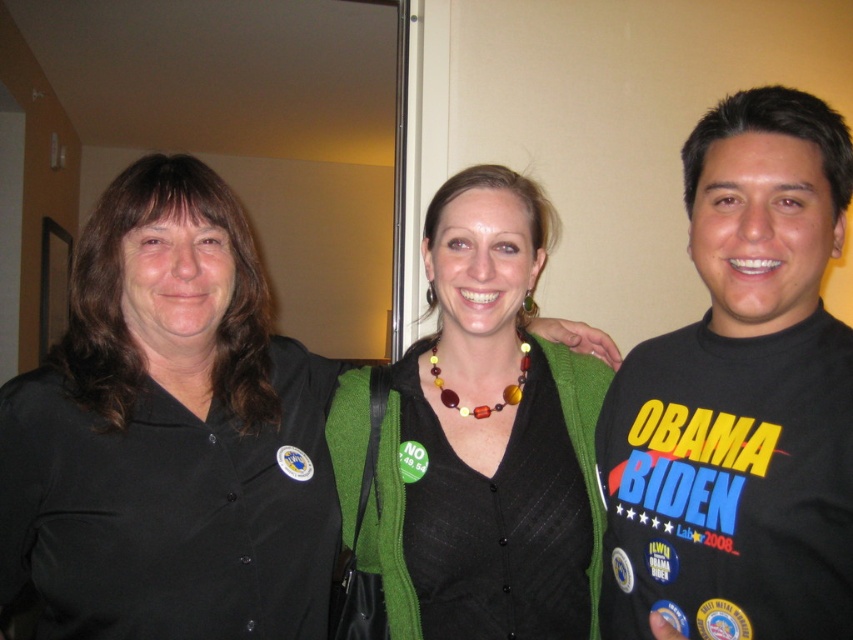
Is black t-shirt at right closer to the viewer compared to green fabric sweater at center?

Yes, it is in front of green fabric sweater at center.

Is point (726, 236) more distant than point (589, 486)?

No.

Identify the location of black t-shirt at right. (740, 400).

Between black matte shirt at center and multicolored beads necklace at center, which one appears on the right side from the viewer's perspective?

multicolored beads necklace at center is more to the right.

Looking at this image, can you confirm if black matte shirt at center is positioned to the left of multicolored beads necklace at center?

Indeed, black matte shirt at center is positioned on the left side of multicolored beads necklace at center.

Does point (250, 364) come closer to viewer compared to point (517, 336)?

Yes.

Where is `black matte shirt at center`? This screenshot has height=640, width=853. black matte shirt at center is located at coordinates (169, 435).

Which is above, black matte shirt at center or green fabric sweater at center?

green fabric sweater at center is higher up.

Is black matte shirt at center to the left of green fabric sweater at center from the viewer's perspective?

Yes, black matte shirt at center is to the left of green fabric sweater at center.

This screenshot has height=640, width=853. I want to click on black matte shirt at center, so click(169, 435).

Identify the location of black matte shirt at center. (169, 435).